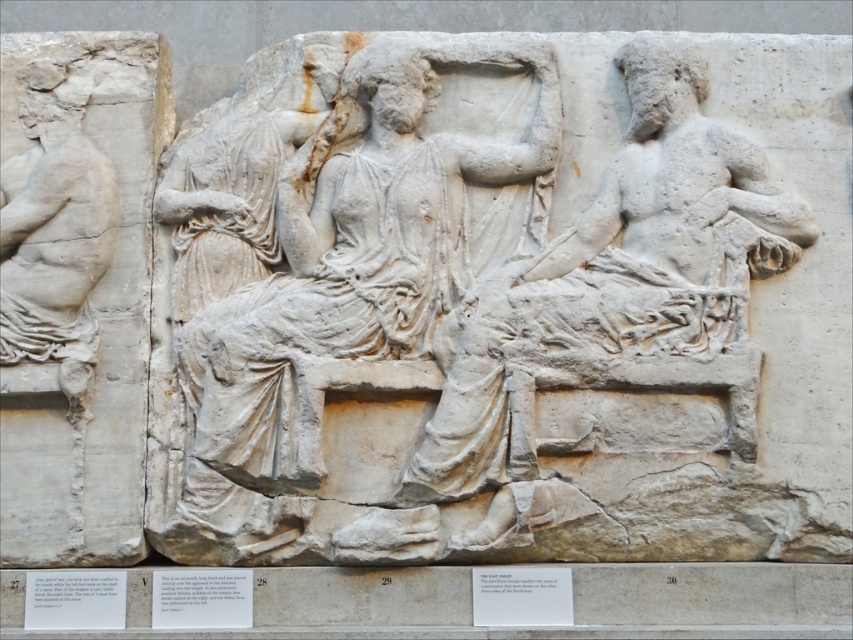
Which is above, white marble figure at center or white stone figure at center?

white marble figure at center

Does white marble figure at center have a larger size compared to white stone figure at center?

Indeed, white marble figure at center has a larger size compared to white stone figure at center.

This screenshot has height=640, width=853. Identify the location of white marble figure at center. (366, 246).

Describe the element at coordinates (366, 246) in the screenshot. I see `white marble figure at center` at that location.

Does white marble figure at center appear over white marble figure at left?

Indeed, white marble figure at center is positioned over white marble figure at left.

Is point (368, 172) more distant than point (79, 364)?

Yes, it is behind point (79, 364).

This screenshot has height=640, width=853. What are the coordinates of `white marble figure at center` in the screenshot? It's located at (366, 246).

How distant is white stone figure at center from white marble figure at left?

white stone figure at center is 10.82 meters from white marble figure at left.

Does white stone figure at center have a smaller size compared to white marble figure at left?

Yes.

This screenshot has height=640, width=853. What are the coordinates of `white stone figure at center` in the screenshot? It's located at (614, 282).